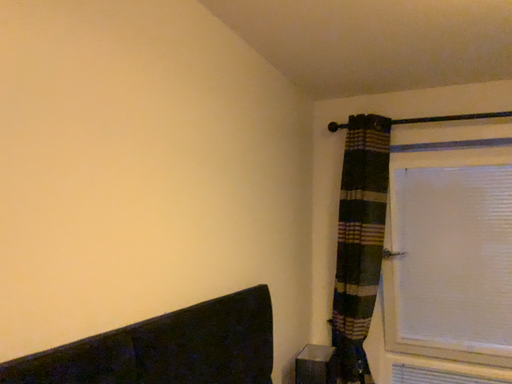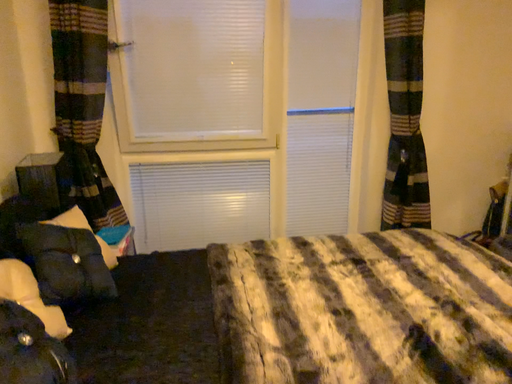
Question: Which way did the camera rotate in the video?

Choices:
 (A) rotated left
 (B) rotated right

Answer: (B)